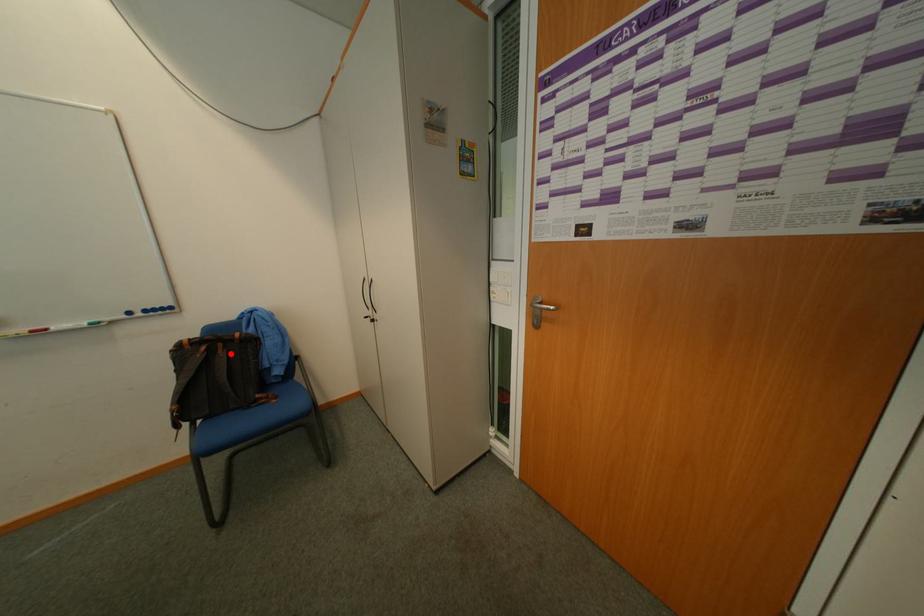
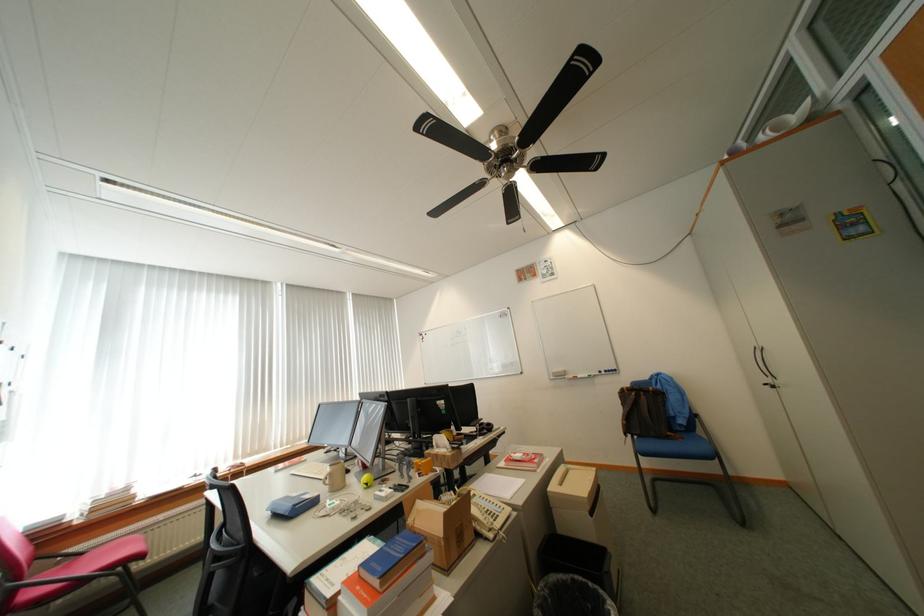
In the second image, find the point that corresponds to the highlighted location in the first image.

(652, 399)